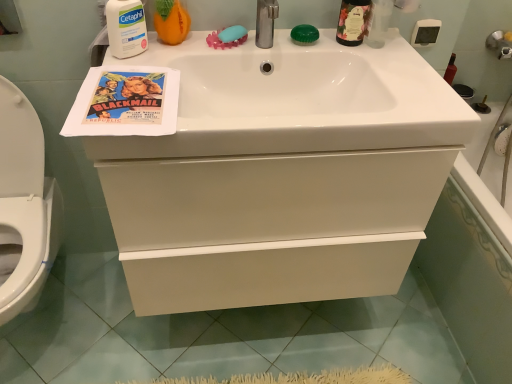
What do you see at coordinates (170, 21) in the screenshot? I see `matte orange pumpkin at upper left, the first cleaning product positioned from the right` at bounding box center [170, 21].

Identify the location of white matte cetaphil at upper left, the first cleaning product positioned from the left. pyautogui.click(x=126, y=28).

Locate an element on the screen. This screenshot has height=384, width=512. white glossy sink at upper center is located at coordinates (296, 100).

Identify the location of matte paper poster at upper left. (125, 103).

Can you confirm if white glossy toilet at lower left is bigger than white glossy cabinet at center?

Actually, white glossy toilet at lower left might be smaller than white glossy cabinet at center.

In the image, is white glossy toilet at lower left on the left side or the right side of white glossy cabinet at center?

white glossy toilet at lower left is positioned on white glossy cabinet at center's left side.

Choose the correct answer: Is white glossy toilet at lower left inside white glossy cabinet at center or outside it?

white glossy toilet at lower left cannot be found inside white glossy cabinet at center.

Which object is closer to the camera, white glossy toilet at lower left or white glossy cabinet at center?

white glossy toilet at lower left is more forward.

Which is nearer, (22,149) or (112,86)?

Point (22,149).

Is white glossy toilet at lower left in front of or behind matte paper poster at upper left in the image?

white glossy toilet at lower left is in front of matte paper poster at upper left.

From the image's perspective, which one is positioned lower, white glossy toilet at lower left or matte paper poster at upper left?

white glossy toilet at lower left.

Find the location of a particular element. counter top lying behind the white glossy toilet at lower left is located at coordinates (296, 100).

From the picture: Is white glossy toilet at lower left outside of white glossy sink at upper center?

Indeed, white glossy toilet at lower left is completely outside white glossy sink at upper center.

Are white glossy toilet at lower left and white glossy sink at upper center located far from each other?

white glossy toilet at lower left is near white glossy sink at upper center, not far away.

Between white glossy toilet at lower left and white glossy sink at upper center, which one is positioned behind?

white glossy sink at upper center is further from the camera.

From the image's perspective, which object appears higher, white glossy bathtub at right or matte paper poster at upper left?

matte paper poster at upper left.

Which is more to the left, white glossy bathtub at right or matte paper poster at upper left?

From the viewer's perspective, matte paper poster at upper left appears more on the left side.

Can you tell me how much white glossy bathtub at right and matte paper poster at upper left differ in facing direction?

There is a 89-degree angle between the facing directions of white glossy bathtub at right and matte paper poster at upper left.

How distant is white glossy bathtub at right from matte paper poster at upper left?

white glossy bathtub at right is 3.35 feet away from matte paper poster at upper left.

Which is closer to the camera, (156,130) or (306,144)?

The point (156,130) is in front.

In the scene shown: In the image, is matte paper poster at upper left on the left side or the right side of white glossy sink at upper center?

matte paper poster at upper left is positioned on white glossy sink at upper center's left side.

Does matte paper poster at upper left have a lesser width compared to white glossy sink at upper center?

Indeed, matte paper poster at upper left has a lesser width compared to white glossy sink at upper center.

Is matte paper poster at upper left smaller than white glossy sink at upper center?

Yes, matte paper poster at upper left is smaller than white glossy sink at upper center.

Is green glossy soap at upper center, which ranks as the first soap in right-to-left order, facing towards green glass bottle at upper right?

No, green glossy soap at upper center, which ranks as the first soap in right-to-left order, is not facing towards green glass bottle at upper right.

Between green glossy soap at upper center, which ranks as the first soap in right-to-left order, and green glass bottle at upper right, which one has smaller width?

Thinner between the two is green glossy soap at upper center, which ranks as the first soap in right-to-left order.

From the green glass bottle at upper right, count 2nd soaps backward and point to it. Please provide its 2D coordinates.

[(304, 34)]

Between green glossy soap at upper center, the 2th soap from the left, and green glass bottle at upper right, which one has larger size?

Bigger between the two is green glass bottle at upper right.

Which of these two, matte orange pumpkin at upper left, the first cleaning product positioned from the right, or green glass bottle at upper right, is wider?

Wider between the two is green glass bottle at upper right.

Looking at this image, how different are the orientations of matte orange pumpkin at upper left, the 2th cleaning product from the left, and green glass bottle at upper right in degrees?

0.00031 degrees.

From the image's perspective, is matte orange pumpkin at upper left, the first cleaning product positioned from the right, under green glass bottle at upper right?

Yes.

Image resolution: width=512 pixels, height=384 pixels. Find the location of `toilet located on the left of white glossy cabinet at center`. toilet located on the left of white glossy cabinet at center is located at coordinates (25, 205).

The height and width of the screenshot is (384, 512). In order to click on toilet that appears in front of the matte paper poster at upper left in this screenshot , I will do `click(25, 205)`.

Estimate the real-world distances between objects in this image. Which object is further from matte paper poster at upper left, white glossy toilet at lower left or green glossy soap at upper center, the 2th soap from the left?

white glossy toilet at lower left lies further to matte paper poster at upper left than the other object.

Estimate the real-world distances between objects in this image. Which object is closer to white glossy cabinet at center, white glossy sink at upper center or green glass bottle at upper right?

Among the two, white glossy sink at upper center is located nearer to white glossy cabinet at center.

Considering their positions, is white matte cetaphil at upper left, the first cleaning product positioned from the left, positioned closer to matte paper poster at upper left than green glass bottle at upper right?

Among the two, white matte cetaphil at upper left, the first cleaning product positioned from the left, is located nearer to matte paper poster at upper left.

Looking at this image, which object lies further to the anchor point green glass bottle at upper right, white glossy toilet at lower left or white glossy bathtub at right?

The object further to green glass bottle at upper right is white glossy toilet at lower left.

Considering their positions, is matte orange pumpkin at upper left, the first cleaning product positioned from the right, positioned further to green glass bottle at upper right than white glossy cabinet at center?

The object further to green glass bottle at upper right is white glossy cabinet at center.

Considering their positions, is white glossy cabinet at center positioned further to white matte cetaphil at upper left, the first cleaning product positioned from the left, than blue rubber soap at upper center, which is the 2th soap from right to left?

The object further to white matte cetaphil at upper left, the first cleaning product positioned from the left, is white glossy cabinet at center.

Looking at the image, which one is located closer to white glossy cabinet at center, white glossy sink at upper center or matte orange pumpkin at upper left, the first cleaning product positioned from the right?

The object closer to white glossy cabinet at center is white glossy sink at upper center.

Considering their positions, is matte paper poster at upper left positioned closer to green glass bottle at upper right than white matte cetaphil at upper left, which appears as the second cleaning product when viewed from the right?

white matte cetaphil at upper left, which appears as the second cleaning product when viewed from the right, is positioned closer to the anchor green glass bottle at upper right.

You are a GUI agent. You are given a task and a screenshot of the screen. Output one action in this format:
    pyautogui.click(x=<x>, y=<y>)
    Task: Click on the counter top between white glossy toilet at lower left and white glossy bathtub at right
    The width and height of the screenshot is (512, 384).
    Given the screenshot: What is the action you would take?
    pyautogui.click(x=296, y=100)

The image size is (512, 384). I want to click on comic book between white glossy toilet at lower left and green glass bottle at upper right from left to right, so click(125, 103).

I want to click on bathroom cabinet between matte paper poster at upper left and white glossy bathtub at right from left to right, so click(x=281, y=174).

The image size is (512, 384). What are the coordinates of `cleaning product between matte orange pumpkin at upper left, the first cleaning product positioned from the right, and white glossy toilet at lower left in the up-down direction` in the screenshot? It's located at (126, 28).